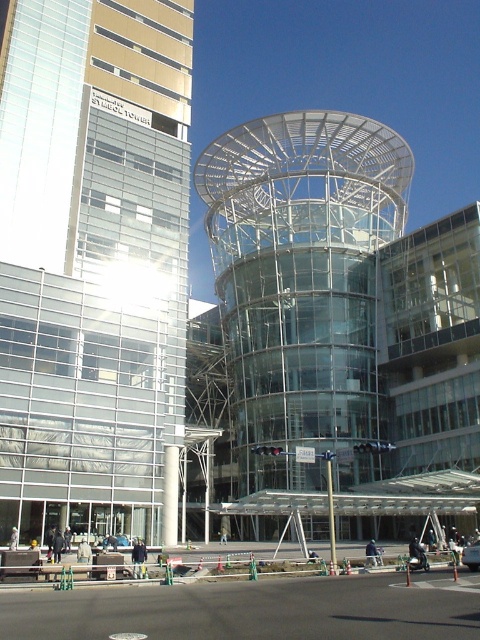
You are an architect evaluating the layout of the modern building complex. You notice the glassy reflective tower at left and the transparent glass tower at center. Which of these two towers is located to the left of the other?

The glassy reflective tower at left is positioned on the left side of the transparent glass tower at center.

You are standing in front of a modern architectural structure. You see a glassy reflective tower at left and a point at coordinates (x=93, y=262). Where is the glassy reflective tower at left located?

The glassy reflective tower at left is located at point (x=93, y=262).